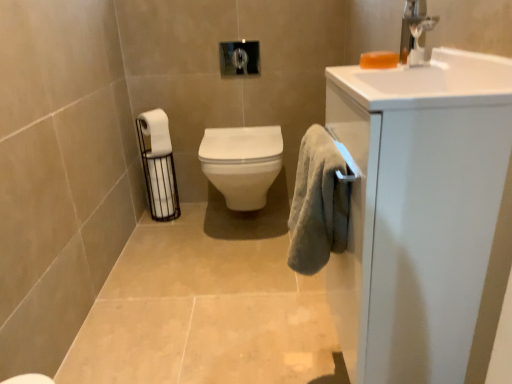
Question: Relative to white glossy toilet at center, is orange translucent soap at upper right in front or behind?

Choices:
 (A) behind
 (B) front

Answer: (B)

Question: Based on their sizes in the image, would you say orange translucent soap at upper right is bigger or smaller than white glossy toilet at center?

Choices:
 (A) small
 (B) big

Answer: (A)

Question: Which of these objects is positioned farthest from the white glossy toilet at center?

Choices:
 (A) white matte toilet paper at left, which is the 1th toilet paper in top-to-bottom order
 (B) soft gray towel at right
 (C) silver metallic faucet at upper right
 (D) orange translucent soap at upper right
 (E) white glossy cabinet at right

Answer: (E)

Question: Estimate the real-world distances between objects in this image. Which object is farther from the white glossy cabinet at right?

Choices:
 (A) white matte toilet paper at left, arranged as the first toilet paper when ordered from the bottom
 (B) white matte toilet paper at left, acting as the second toilet paper starting from the bottom
 (C) white glossy toilet at center
 (D) soft gray towel at right
 (E) orange translucent soap at upper right

Answer: (B)